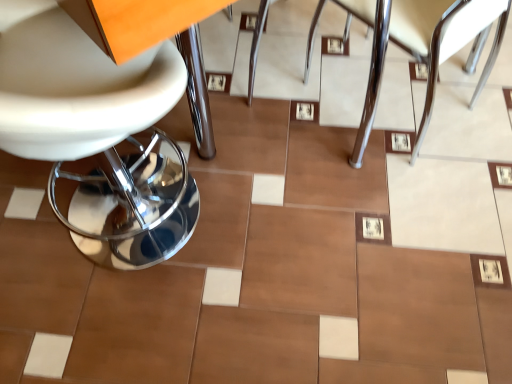
Where is `vacant area that is in front of white leather chair at left, the 1th chair from the left`? The image size is (512, 384). vacant area that is in front of white leather chair at left, the 1th chair from the left is located at coordinates (130, 331).